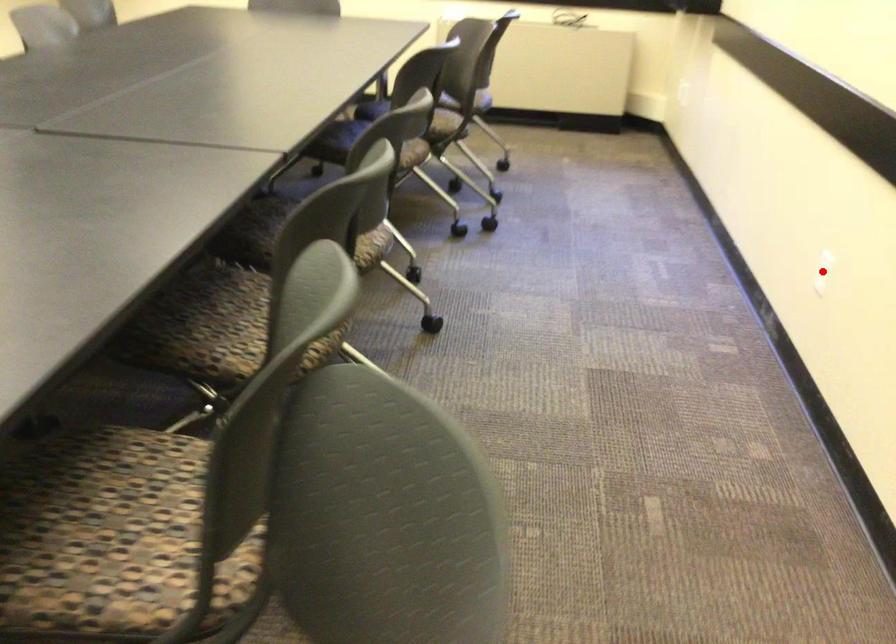
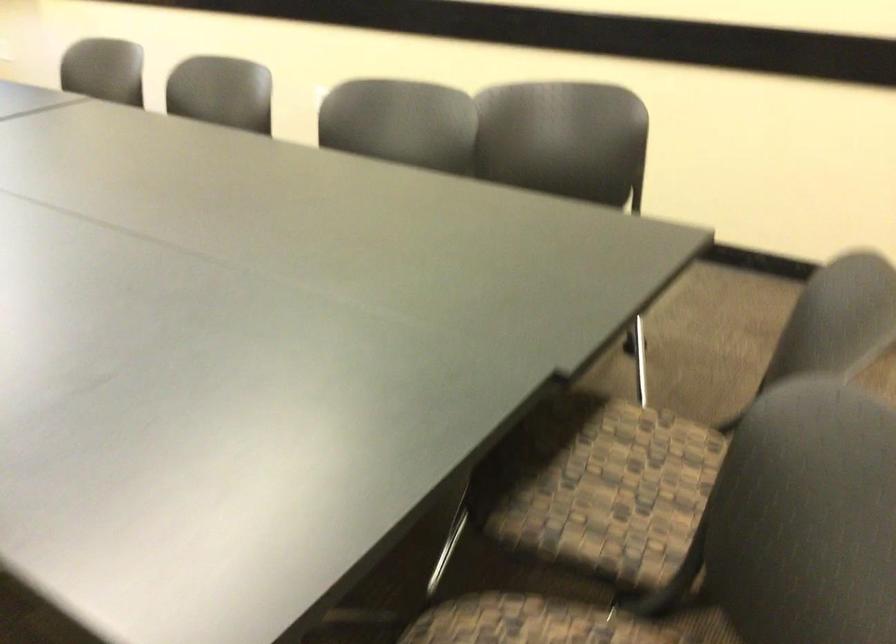
Question: I am providing you with two images of the same scene from different viewpoints. A red point is marked on the first image. Can you still see the location of the red point in image 2?

Choices:
 (A) Yes
 (B) No

Answer: (B)